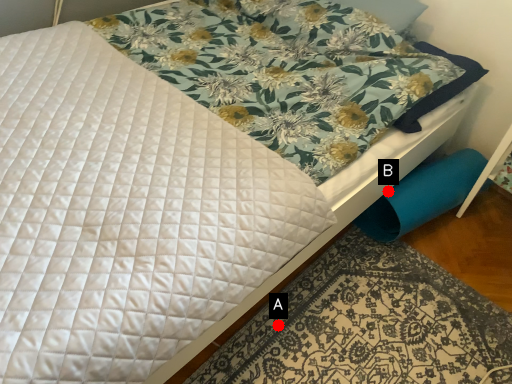
Question: Two points are circled on the image, labeled by A and B beside each circle. Which point is closer to the camera?

Choices:
 (A) A is closer
 (B) B is closer

Answer: (A)